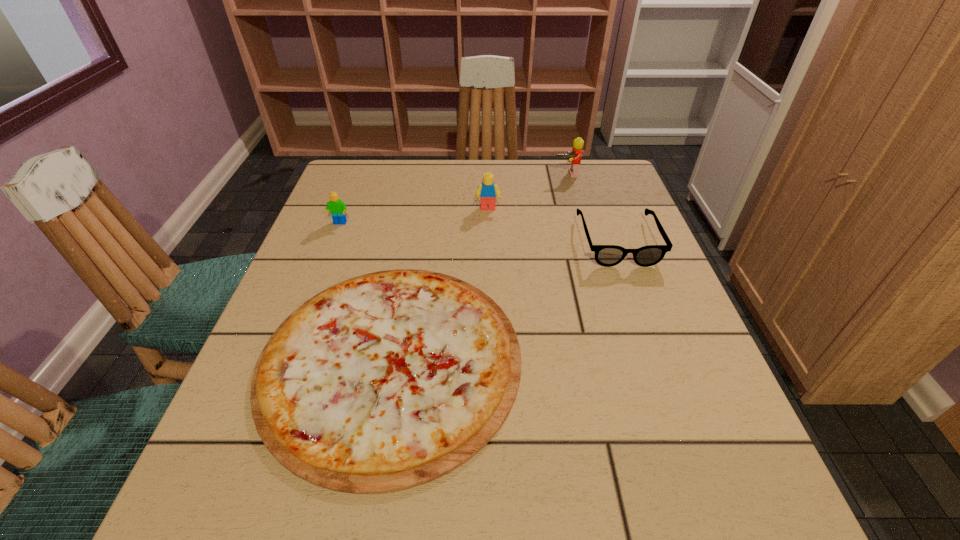
Find the location of a particular element. The image size is (960, 540). free space located 0.310m on the front-facing side of the second farthest Lego is located at coordinates (490, 301).

Find the location of `free space located 0.330m on the face of the leftmost Lego`. free space located 0.330m on the face of the leftmost Lego is located at coordinates (299, 330).

Find the location of a particular element. blank space located 0.150m on the arms of the second shortest object is located at coordinates (645, 318).

Locate an element on the screen. The image size is (960, 540). vacant space located 0.260m on the right of the shortest object is located at coordinates (666, 360).

Locate an element on the screen. This screenshot has height=540, width=960. object that is at the near edge is located at coordinates (386, 381).

Where is `Lego at the left edge`? This screenshot has width=960, height=540. Lego at the left edge is located at coordinates (337, 207).

Where is `pizza that is at the left edge`? The image size is (960, 540). pizza that is at the left edge is located at coordinates (386, 381).

Where is `Lego located in the right edge section of the desktop`? This screenshot has width=960, height=540. Lego located in the right edge section of the desktop is located at coordinates (574, 157).

Locate an element on the screen. The image size is (960, 540). spectacles situated at the right edge is located at coordinates (605, 255).

Find the location of a particular element. object at the near left corner is located at coordinates (386, 381).